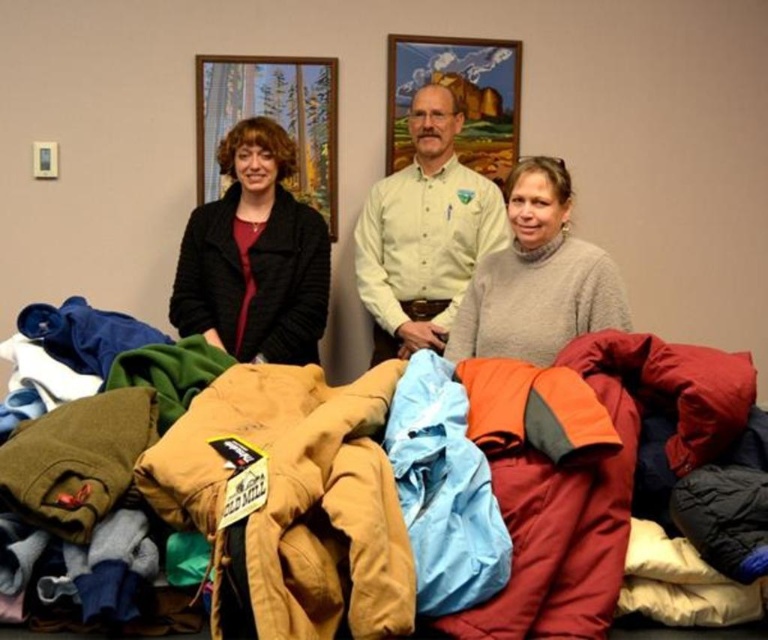
Can you confirm if white button-down shirt at center is positioned below wooden frame at upper center?

Yes, white button-down shirt at center is below wooden frame at upper center.

Is point (404, 269) closer to camera compared to point (303, 140)?

Yes, point (404, 269) is closer to viewer.

This screenshot has height=640, width=768. What are the coordinates of `white button-down shirt at center` in the screenshot? It's located at (424, 232).

Can you confirm if white button-down shirt at center is positioned above light gray wool sweater at center?

Indeed, white button-down shirt at center is positioned over light gray wool sweater at center.

Which is more to the left, white button-down shirt at center or light gray wool sweater at center?

From the viewer's perspective, white button-down shirt at center appears more on the left side.

Who is more distant from viewer, (406,225) or (541,339)?

Point (406,225)

I want to click on white button-down shirt at center, so click(424, 232).

Can you confirm if wooden frame at upper center is wider than wooden picture frame at upper center?

In fact, wooden frame at upper center might be narrower than wooden picture frame at upper center.

Does wooden frame at upper center have a smaller size compared to wooden picture frame at upper center?

Incorrect, wooden frame at upper center is not smaller in size than wooden picture frame at upper center.

The image size is (768, 640). Identify the location of wooden frame at upper center. (272, 118).

Where is `wooden frame at upper center`? Image resolution: width=768 pixels, height=640 pixels. wooden frame at upper center is located at coordinates (272, 118).